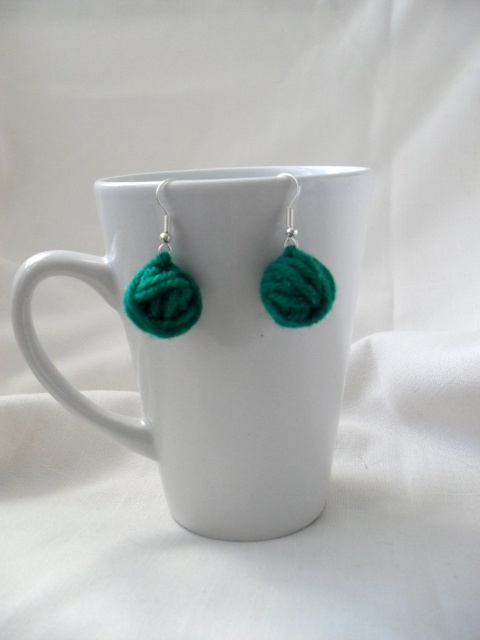
You are an interior designer working on a project and need to place a decorative item exactly at point (223, 339) in the scene. Which object from the image is already positioned there?

The white ceramic mug at center is located at point (223, 339).

You are a photographer adjusting the focus on your camera. You want to capture a closeup of the white ceramic mug and the two teal green earrings resting on its rim. The focus distance of your camera is currently set to 37.67 inches. Will the point at coordinates point (154,305) be in focus?

The point at coordinates point (154,305) is exactly 37.67 inches from the camera, so it will be in focus.

You are a delivery robot that needs to place a small package between the white ceramic mug at center and the green yarn ball at center. The package is 8 inches long. Will it fit in the space between them?

The distance between the white ceramic mug at center and the green yarn ball at center is 7.45 inches. Since the package is 8 inches long, it will not fit in the space between them.